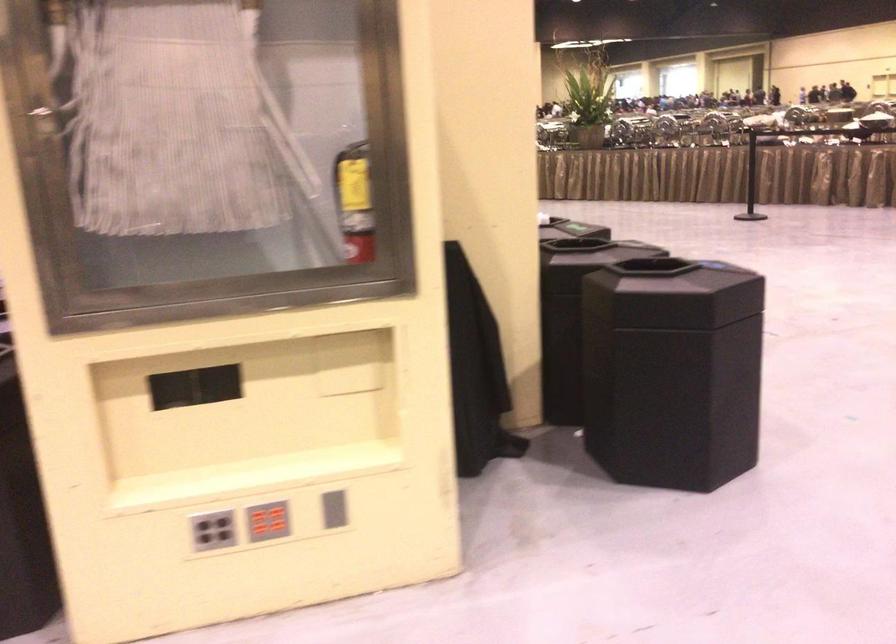
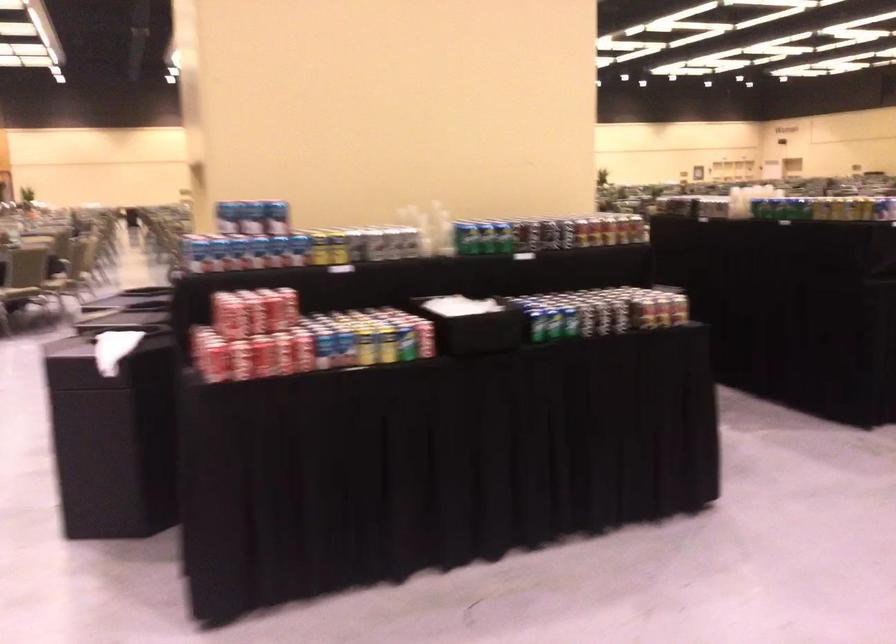
Question: I am providing you with two images of the same scene from different viewpoints. Which of the following objects are not visible in image2?

Choices:
 (A) green silicone container
 (B) red soda can
 (C) clear plastic cup
 (D) grey button panel

Answer: (D)